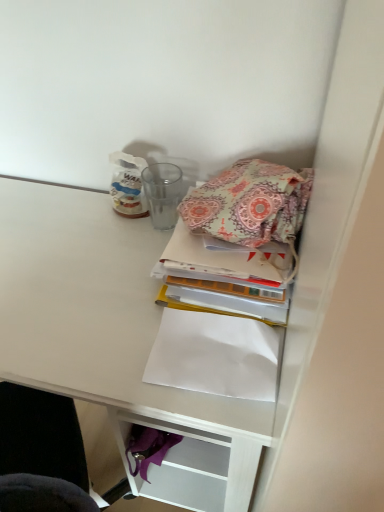
Locate an element on the screen. Image resolution: width=384 pixels, height=512 pixels. vacant region under white paper at lower center (from a real-world perspective) is located at coordinates (212, 368).